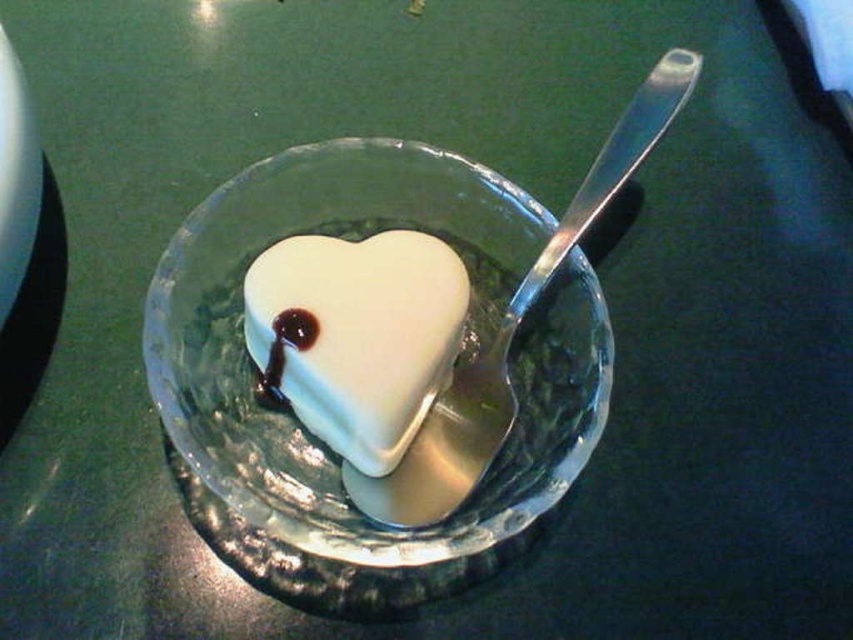
You are a customer at a bakery and see the dessert in the glass bowl. The server tells you that the silver spoon is located at coordinates point (x=358, y=333). Can you describe what the spoon is touching?

The point (x=358, y=333) is on the white glossy heart at center, so the spoon is touching the white glossy heart at center.